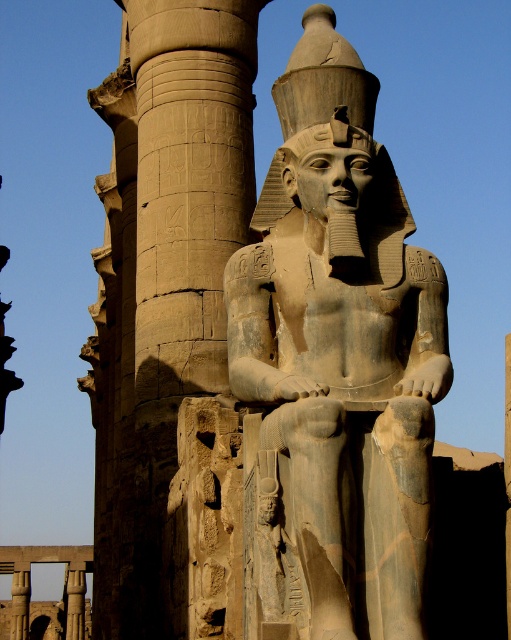
Question: Which of the following is the closest to the observer?

Choices:
 (A) gray stone statue at center
 (B) sandstone column at center

Answer: (A)

Question: Is gray stone statue at center above sandstone column at center?

Choices:
 (A) no
 (B) yes

Answer: (B)

Question: Does gray stone statue at center have a smaller size compared to sandstone column at center?

Choices:
 (A) yes
 (B) no

Answer: (A)

Question: Among these points, which one is farthest from the camera?

Choices:
 (A) (150, 17)
 (B) (334, 113)

Answer: (A)

Question: From the image, what is the correct spatial relationship of gray stone statue at center in relation to sandstone column at center?

Choices:
 (A) right
 (B) left

Answer: (A)